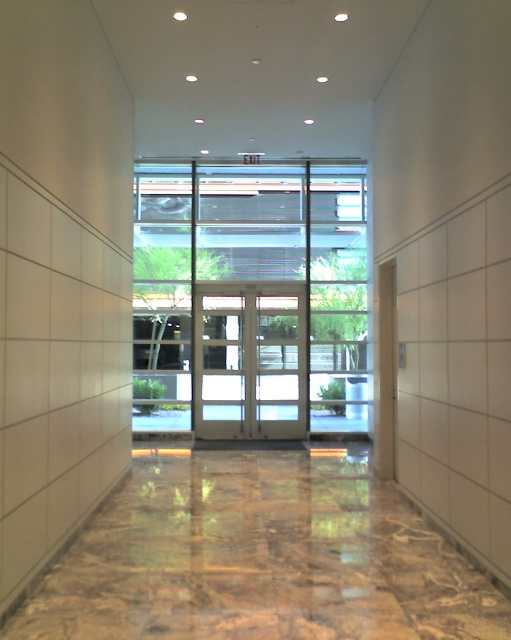
Question: Is white glass door at center below matte glass door at center?

Choices:
 (A) no
 (B) yes

Answer: (B)

Question: Does white glass door at center have a lesser width compared to matte glass door at center?

Choices:
 (A) yes
 (B) no

Answer: (A)

Question: Which of the following is the closest to the observer?

Choices:
 (A) (238, 305)
 (B) (274, 342)

Answer: (B)

Question: Can you confirm if clear glass doors at center is thinner than matte glass door at center?

Choices:
 (A) no
 (B) yes

Answer: (A)

Question: Based on their relative distances, which object is farther from the matte glass door at center?

Choices:
 (A) white glass door at center
 (B) white glass doors at center
 (C) clear glass doors at center

Answer: (C)

Question: Which point is closer to the camera?

Choices:
 (A) (218, 428)
 (B) (321, 170)

Answer: (A)